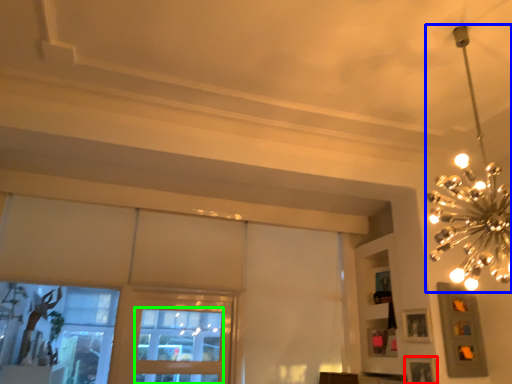
Question: Which is nearer to the picture frame (highlighted by a red box)? lamp (highlighted by a blue box) or window (highlighted by a green box).

Choices:
 (A) lamp
 (B) window

Answer: (A)